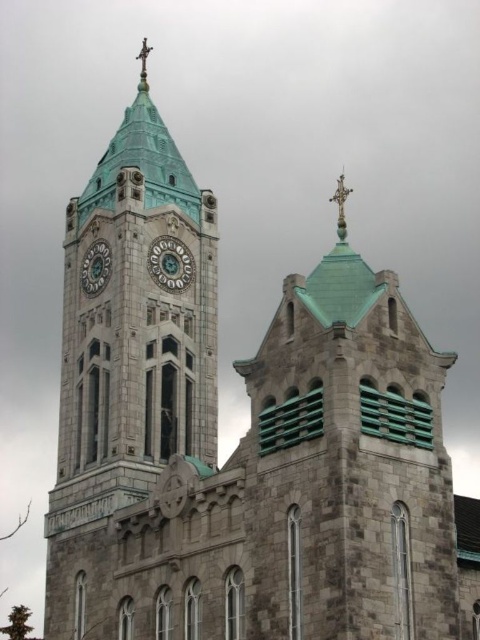
Question: Which point is closer to the camera?

Choices:
 (A) (210, 310)
 (B) (147, 259)
 (C) (331, 200)
 (D) (94, 292)

Answer: (B)

Question: Is green stone clock at center thinner than silver metallic cross at upper center?

Choices:
 (A) yes
 (B) no

Answer: (A)

Question: Observing the image, what is the correct spatial positioning of green stone clock at center in reference to green stone clock at upper left?

Choices:
 (A) above
 (B) below

Answer: (A)

Question: Is the position of green stone clock at center more distant than that of green stone clock at upper left?

Choices:
 (A) no
 (B) yes

Answer: (B)

Question: Which point is closer to the camera taking this photo?

Choices:
 (A) (143, 54)
 (B) (175, 248)

Answer: (B)

Question: Which of these objects is positioned farthest from the metallic cross at top?

Choices:
 (A) green stone clock at center
 (B) silver metallic cross at upper center
 (C) green stone clock at upper left
 (D) teal stone clock tower at center-left

Answer: (C)